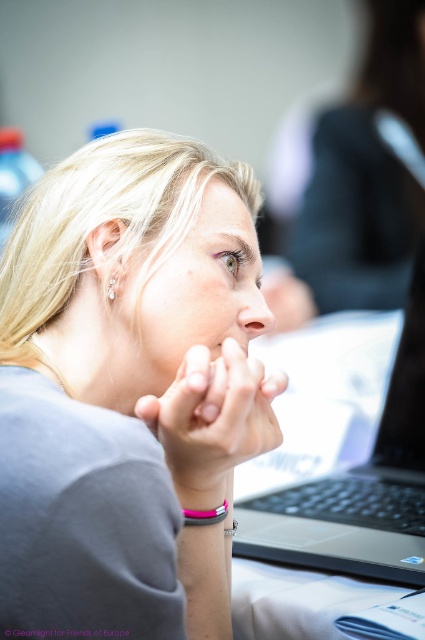
Question: Can you confirm if silver metallic bracelet at lower center is wider than pink rubber bracelet at center?

Choices:
 (A) yes
 (B) no

Answer: (A)

Question: Which object appears farthest from the camera in this image?

Choices:
 (A) smooth skin hand at center
 (B) pink rubber bracelet at center
 (C) silver metallic bracelet at lower center

Answer: (B)

Question: Which object is the farthest from the sleek black laptop at center?

Choices:
 (A) silver metallic bracelet at lower center
 (B) gray matte shirt at center
 (C) smooth skin hand at center

Answer: (A)

Question: Which point is farther to the camera?

Choices:
 (A) gray matte shirt at center
 (B) sleek black laptop at center

Answer: (B)

Question: Does silver metallic bracelet at lower center appear on the left side of pink rubber bracelet at center?

Choices:
 (A) yes
 (B) no

Answer: (A)

Question: Does gray matte shirt at center have a larger size compared to pink rubber bracelet at center?

Choices:
 (A) no
 (B) yes

Answer: (B)